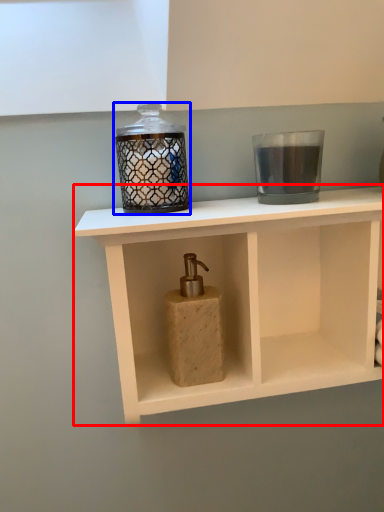
Question: Which point is further to the camera, shelf (highlighted by a red box) or candle holder (highlighted by a blue box)?

Choices:
 (A) shelf
 (B) candle holder

Answer: (B)